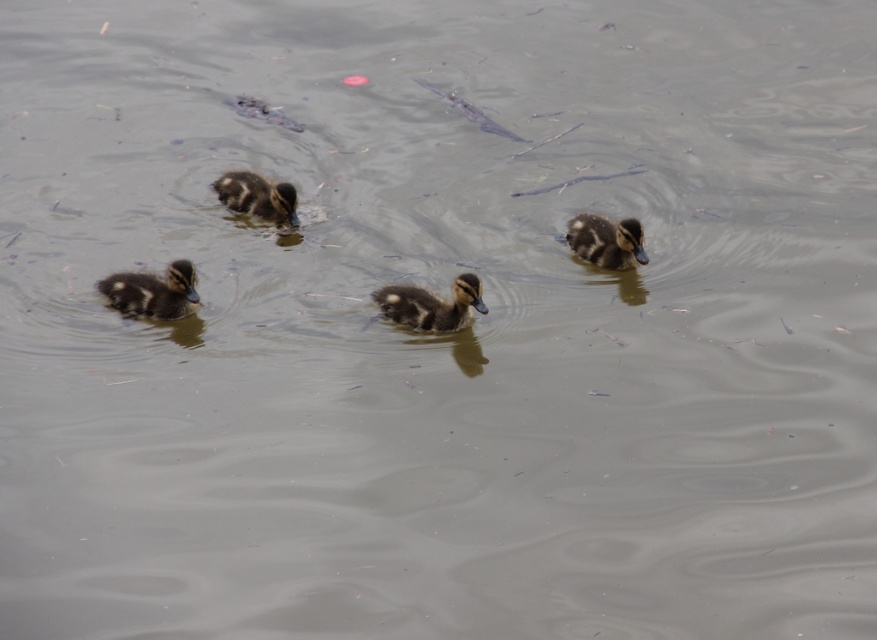
Question: Which of the following is the closest to the observer?

Choices:
 (A) brown fuzzy duckling at right
 (B) brown fuzzy duckling at center
 (C) brown fuzzy duckling at lower left

Answer: (B)

Question: Which object is farther from the camera taking this photo?

Choices:
 (A) brown fuzzy duckling at upper center
 (B) brown fuzzy duckling at lower left
 (C) brown fuzzy duckling at right

Answer: (A)

Question: Does brown fuzzy duckling at center have a lesser width compared to brown fuzzy duckling at upper center?

Choices:
 (A) yes
 (B) no

Answer: (B)

Question: Is brown fuzzy duckling at lower left smaller than brown fuzzy duckling at upper center?

Choices:
 (A) yes
 (B) no

Answer: (B)

Question: Which is farther from the brown fuzzy duckling at center?

Choices:
 (A) brown fuzzy duckling at right
 (B) brown fuzzy duckling at upper center
 (C) brown fuzzy duckling at lower left

Answer: (B)

Question: Does brown fuzzy duckling at lower left have a greater width compared to brown fuzzy duckling at upper center?

Choices:
 (A) no
 (B) yes

Answer: (B)